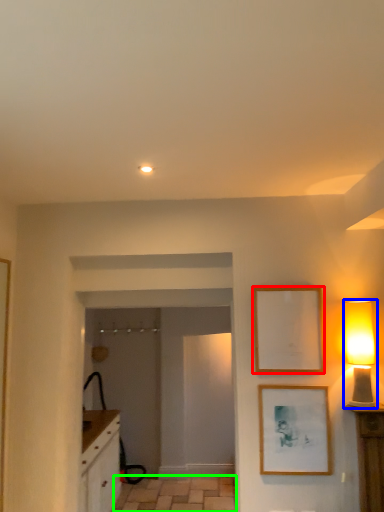
Question: Considering the real-world distances, which object is closest to picture frame (highlighted by a red box)? table lamp (highlighted by a blue box) or tile (highlighted by a green box).

Choices:
 (A) table lamp
 (B) tile

Answer: (A)